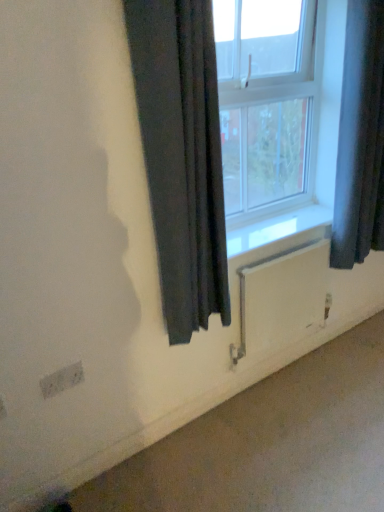
You are a GUI agent. You are given a task and a screenshot of the screen. Output one action in this format:
    pyautogui.click(x=<x>, y=<y>)
    Task: Click on the empty space that is ontop of white matte radiator at lower center
    This screenshot has height=512, width=384.
    Given the screenshot: What is the action you would take?
    pyautogui.click(x=275, y=247)